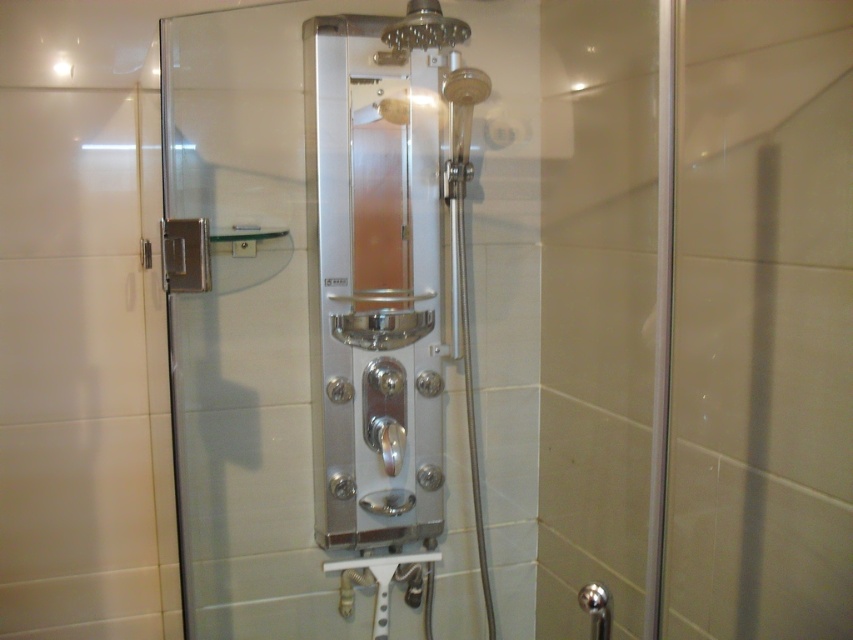
You are designing a bathroom layout and need to place a 1.2 meter wide vanity next to the silver metallic shower door at center and the polished stainless steel shower enclosure at center. Which one should the vanity be placed next to if you want the vanity to fit without overlapping?

The silver metallic shower door at center is wider than the polished stainless steel shower enclosure at center. Therefore, placing the 1.2 meter wide vanity next to the shower enclosure would ensure it fits better without overlapping since the shower door is wider and may not leave enough space.

You are standing in the shower enclosure and want to reach both the rainfall showerhead and the handheld showerhead. The rainfall showerhead is located at point (374, 529) and the handheld showerhead is at point (369, 410). Which one do you need to reach first to avoid getting wet?

Point (374, 529) is behind point (369, 410), so you should reach the handheld showerhead at point (369, 410) first to avoid getting wet from the rainfall showerhead behind you.